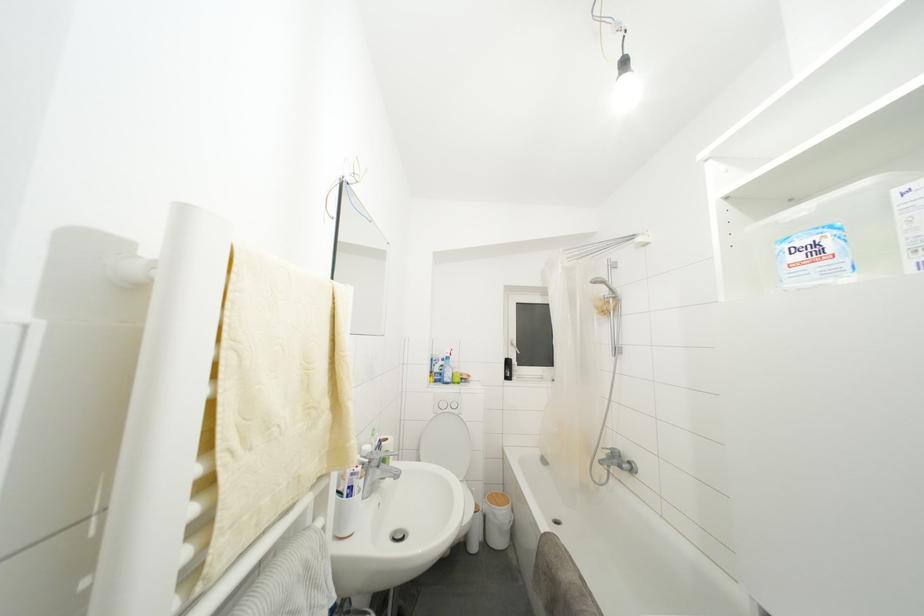
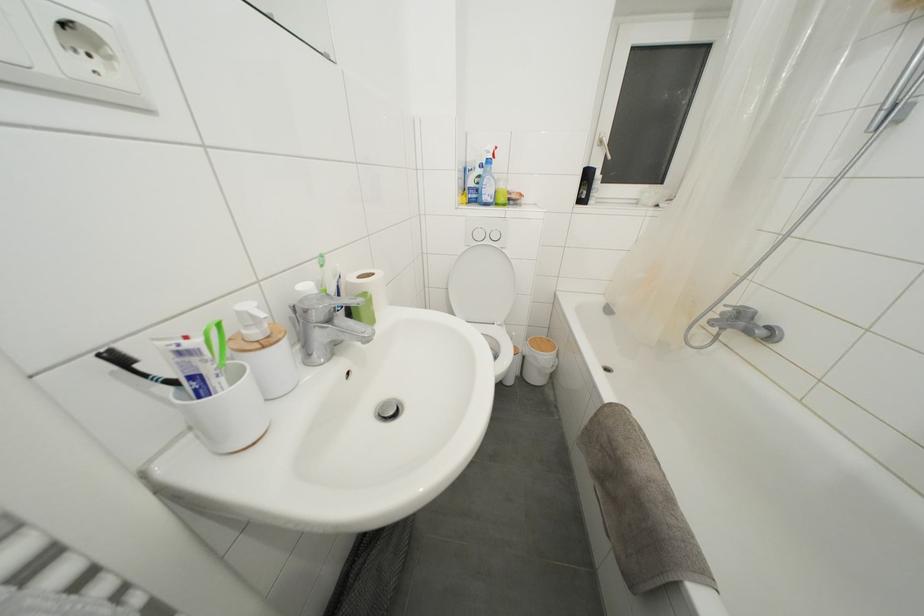
Question: How did the camera likely rotate?

Choices:
 (A) Left
 (B) Right
 (C) Up
 (D) Down

Answer: (D)